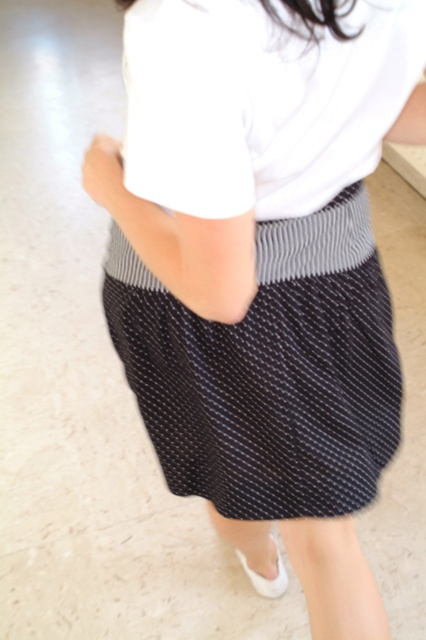
Based on the photo, you are a fashion designer analyzing a model wearing a black textured skirt at center and a white cotton shirt at center. Which piece of clothing is higher on the body?

The black textured skirt at center is taller than the white cotton shirt at center, so the skirt reaches higher up the body.

You are a photographer standing at a distance. You want to take a clear photo of the black textured skirt at center. What is the minimum distance you should maintain to ensure the skirt is in focus?

The minimum distance you should maintain to ensure the black textured skirt at center is in focus is 27.72 inches, as that is the distance between the viewer and the black textured skirt at center.

You are a fashion designer looking at a model wearing a black textured skirt at center and a white cotton shirt at center. Which piece of clothing is more to the left?

The black textured skirt at center is positioned on the left side of the white cotton shirt at center, so it is more to the left.